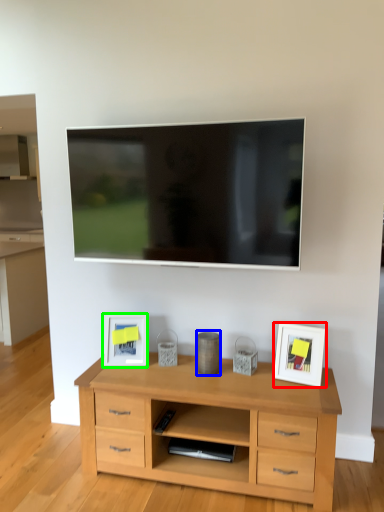
Question: Based on their relative distances, which object is farther from picture frame (highlighted by a red box)? Choose from appliance (highlighted by a blue box) and picture frame (highlighted by a green box).

Choices:
 (A) appliance
 (B) picture frame

Answer: (B)